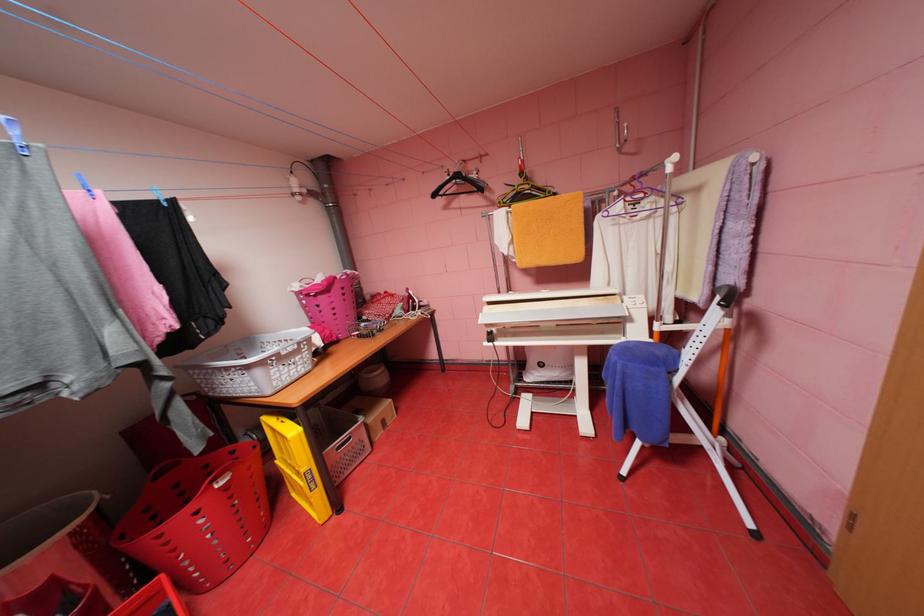
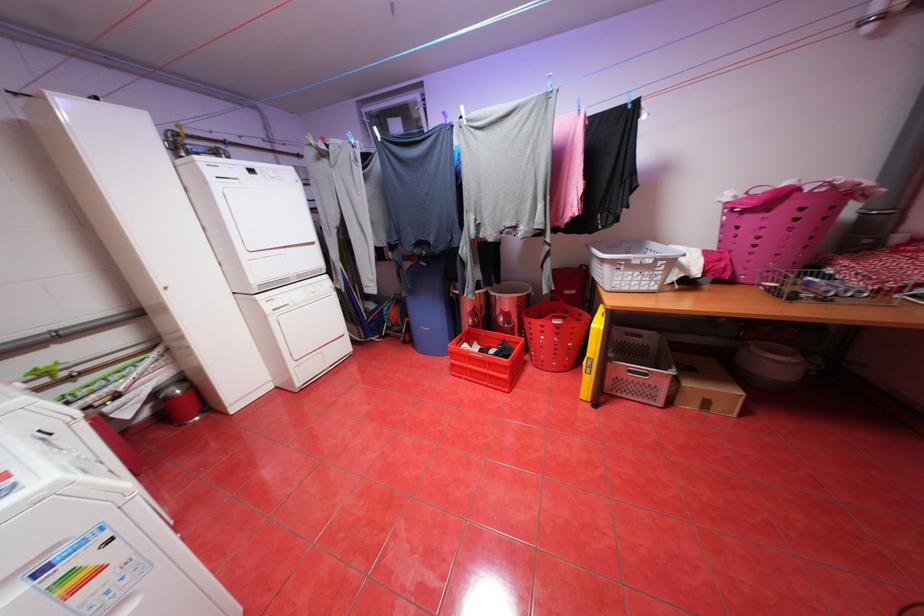
Locate, in the second image, the point that corresponds to (286,354) in the first image.

(637, 261)